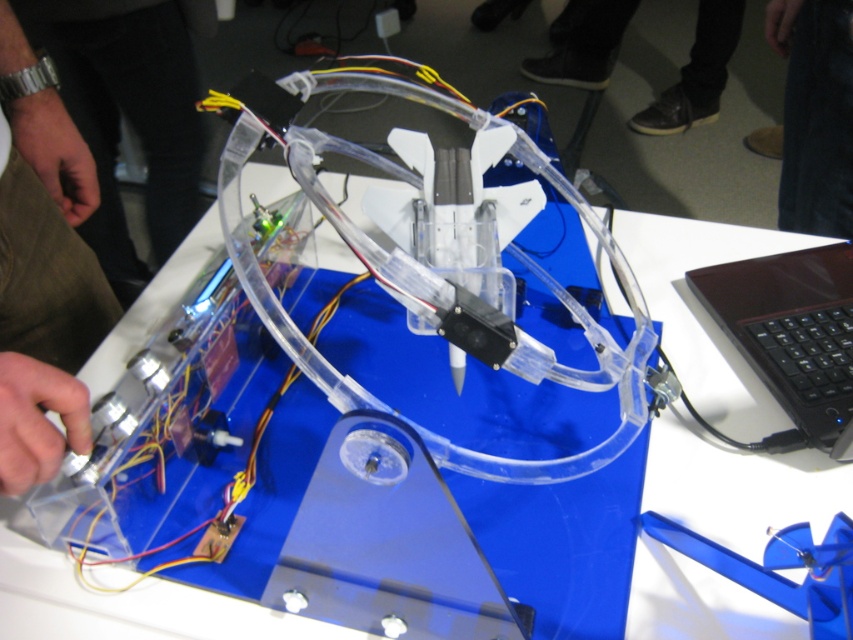
Question: Can you confirm if metal watch at left is positioned below dark blue jeans at center?

Choices:
 (A) no
 (B) yes

Answer: (B)

Question: Can you confirm if metallic wristwatch at left is bigger than black leather shoes at lower center?

Choices:
 (A) yes
 (B) no

Answer: (A)

Question: Among these objects, which one is farthest from the camera?

Choices:
 (A) metallic wristwatch at left
 (B) black leather shoes at lower center

Answer: (B)

Question: Can you confirm if dark blue jeans at center is positioned to the left of black leather shoes at lower center?

Choices:
 (A) no
 (B) yes

Answer: (B)

Question: Among these objects, which one is nearest to the camera?

Choices:
 (A) shiny black laptop at center
 (B) dark blue jeans at center
 (C) transparent plastic table at center

Answer: (C)

Question: Among these points, which one is farthest from the camera?

Choices:
 (A) (838, 12)
 (B) (735, 269)
 (C) (724, 19)

Answer: (C)